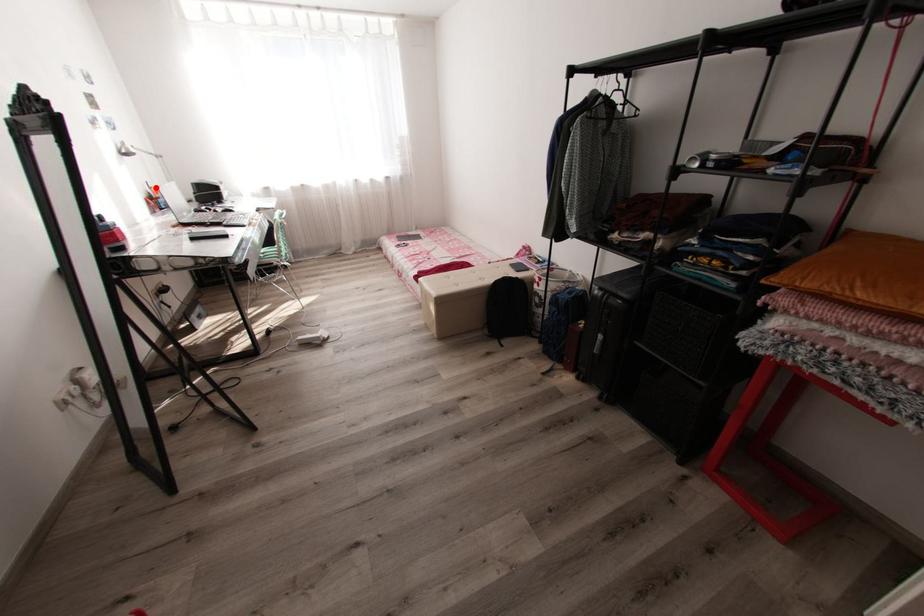
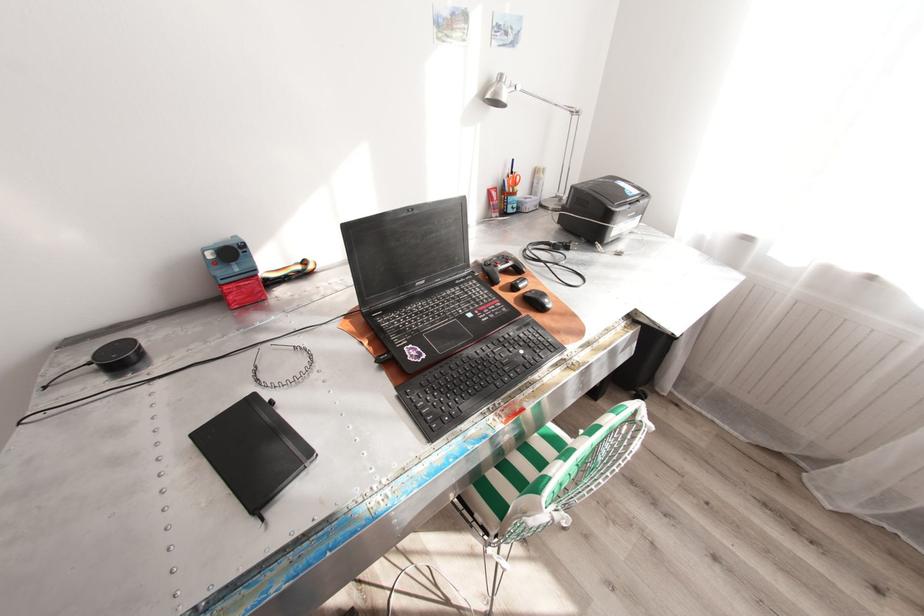
Where in the second image is the point corresponding to the highlighted location from the first image?

(517, 172)